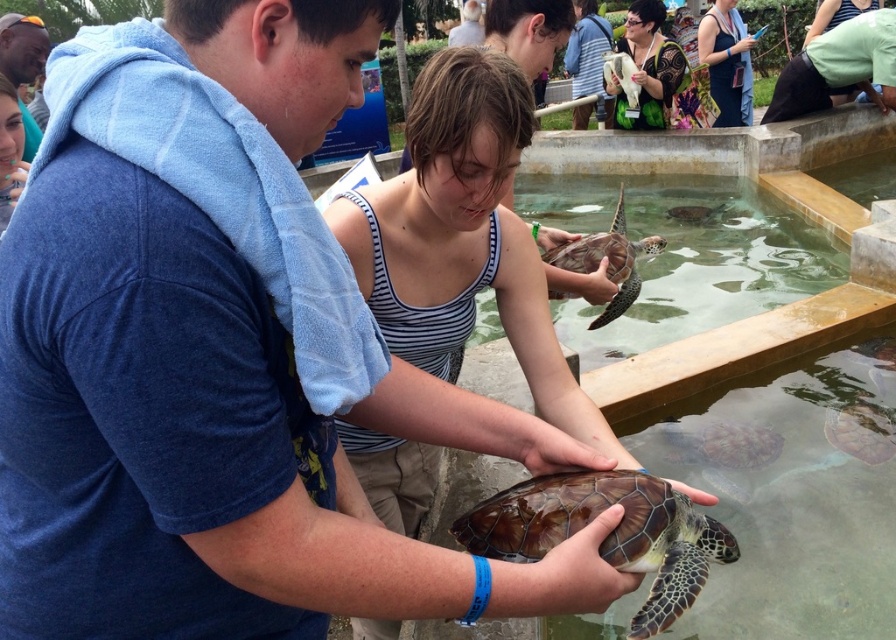
You are a photographer trying to capture a group photo of the striped tank top at center and the patterned fabric dress at upper center. Since you want both subjects to appear the same height in the photo, which one should you position closer to the camera?

The striped tank top at center is much taller than the patterned fabric dress at upper center. To make them appear the same height in the photo, position the shorter subject, the patterned fabric dress at upper center, closer to the camera.

You are an animal caretaker at the marine facility. You need to determine which object is thinner between the matte black turtle at upper center and the green fabric pants at lower right. Which one is thinner?

The matte black turtle at upper center is thinner than the green fabric pants at lower right according to the description.

You are a tour guide at the marine facility and need to ensure visitors maintain a minimum distance of 15 feet for safety. You notice two visitors wearing striped tank top at center and patterned fabric dress at upper center. Can they safely stand at their current positions without violating the distance rule?

The distance between striped tank top at center and patterned fabric dress at upper center is 18.53 feet, which exceeds the required 15 feet minimum. Therefore, they can safely remain in their current positions without violating the safety distance rule.